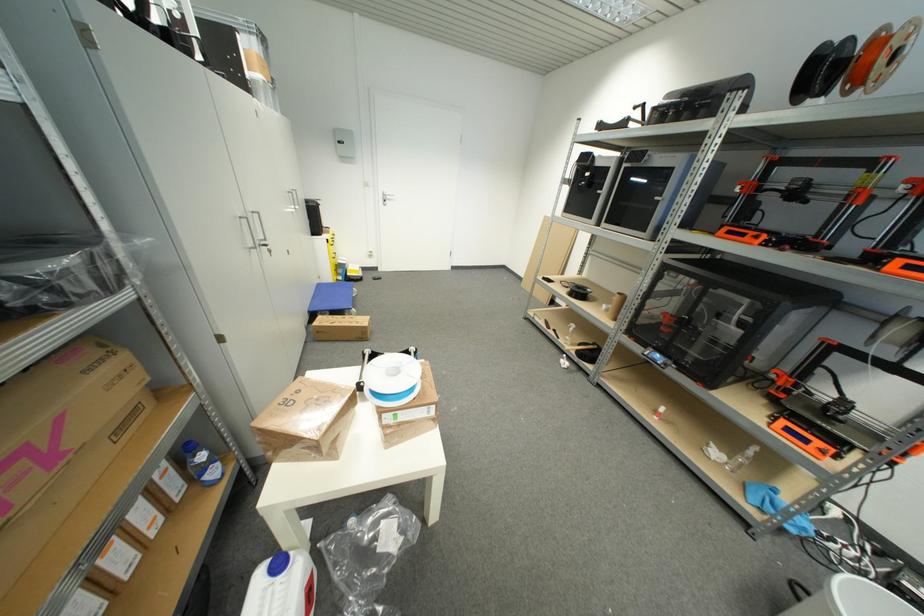
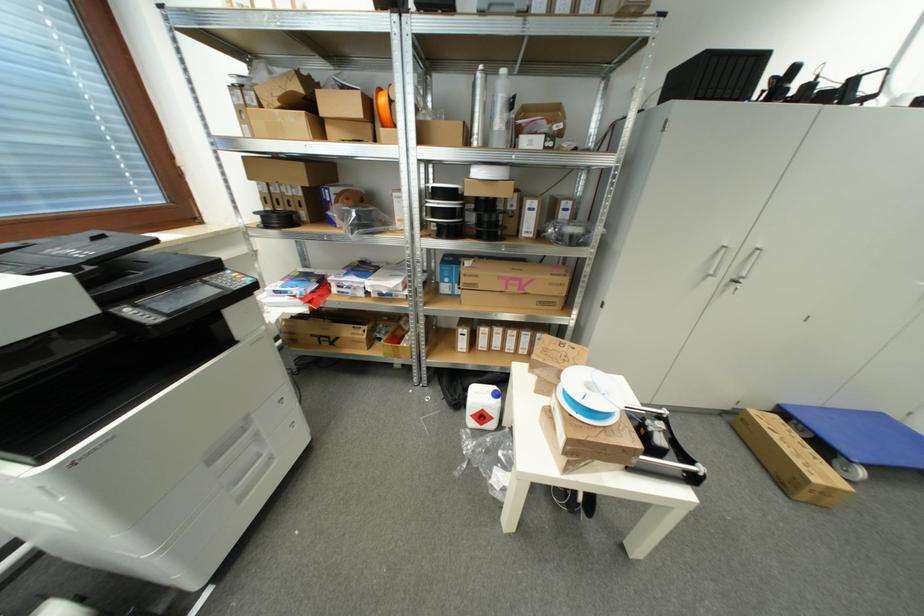
In the second image, find the point that corresponds to point (323, 320) in the first image.

(781, 419)